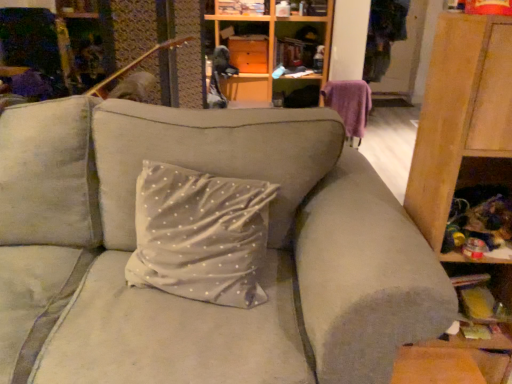
What is the approximate width of light gray fabric couch at center?

It is 37.93 inches.

What do you see at coordinates (300, 50) in the screenshot? This screenshot has height=384, width=512. I see `matte wood cabinet at upper center` at bounding box center [300, 50].

What is the approximate height of wooden cabinet at right?

The height of wooden cabinet at right is 3.87 feet.

Image resolution: width=512 pixels, height=384 pixels. I want to click on light gray fabric couch at center, so click(195, 300).

What's the angular difference between light gray fabric couch at center and wooden cabinet at right's facing directions?

3 degrees separate the facing orientations of light gray fabric couch at center and wooden cabinet at right.

This screenshot has height=384, width=512. In order to click on dresser that is behind the light gray fabric couch at center in this screenshot , I will do `click(458, 113)`.

Are light gray fabric couch at center and wooden cabinet at right making contact?

No, light gray fabric couch at center is not beside wooden cabinet at right.

Is light gray fabric couch at center turned away from wooden cabinet at right?

No, light gray fabric couch at center is not facing away from wooden cabinet at right.

From a real-world perspective, who is located higher, wooden cabinet at right or light gray fabric couch at center?

wooden cabinet at right, from a real-world perspective.

Consider the image. Is wooden cabinet at right wider or thinner than light gray fabric couch at center?

Considering their sizes, wooden cabinet at right looks slimmer than light gray fabric couch at center.

From the picture: Considering the relative sizes of wooden cabinet at right and light gray fabric couch at center in the image provided, is wooden cabinet at right shorter than light gray fabric couch at center?

No.

Is wooden cabinet at right to the right of light gray fabric couch at center from the viewer's perspective?

Indeed, wooden cabinet at right is positioned on the right side of light gray fabric couch at center.

Does wooden cabinet at right turn towards matte wood cabinet at upper center?

No.

Considering the sizes of objects wooden cabinet at right and matte wood cabinet at upper center in the image provided, who is shorter, wooden cabinet at right or matte wood cabinet at upper center?

matte wood cabinet at upper center is shorter.

Is wooden cabinet at right not close to matte wood cabinet at upper center?

wooden cabinet at right is far away from matte wood cabinet at upper center.

Considering the relative positions of wooden cabinet at right and matte wood cabinet at upper center in the image provided, is wooden cabinet at right to the left of matte wood cabinet at upper center from the viewer's perspective?

No.

Considering the sizes of light gray fabric couch at center and purple fabric swivel chair at upper right in the image, is light gray fabric couch at center wider or thinner than purple fabric swivel chair at upper right?

light gray fabric couch at center is wider than purple fabric swivel chair at upper right.

Is light gray fabric couch at center facing towards purple fabric swivel chair at upper right?

No, light gray fabric couch at center is not turned towards purple fabric swivel chair at upper right.

Which is closer, (45, 273) or (344, 98)?

Clearly, point (45, 273) is closer to the camera than point (344, 98).

Is the surface of light gray fabric couch at center in direct contact with purple fabric swivel chair at upper right?

No.

Who is taller, purple fabric swivel chair at upper right or light gray fabric couch at center?

light gray fabric couch at center.

Which of these two, purple fabric swivel chair at upper right or light gray fabric couch at center, is wider?

With larger width is light gray fabric couch at center.

From the image's perspective, which is below, purple fabric swivel chair at upper right or light gray fabric couch at center?

light gray fabric couch at center is shown below in the image.

Can you confirm if purple fabric swivel chair at upper right is bigger than light gray fabric couch at center?

No.

Considering the positions of objects matte wood cabinet at upper center and light gray fabric couch at center in the image provided, who is more to the left, matte wood cabinet at upper center or light gray fabric couch at center?

Positioned to the left is light gray fabric couch at center.

Considering the positions of point (298, 34) and point (106, 360), is point (298, 34) closer or farther from the camera than point (106, 360)?

Point (298, 34) is positioned farther from the camera compared to point (106, 360).

From a real-world perspective, is matte wood cabinet at upper center located beneath light gray fabric couch at center?

No, from a real-world perspective, matte wood cabinet at upper center is not below light gray fabric couch at center.

Is matte wood cabinet at upper center bigger than light gray fabric couch at center?

Incorrect, matte wood cabinet at upper center is not larger than light gray fabric couch at center.

From the image's perspective, relative to purple fabric swivel chair at upper right, is matte wood cabinet at upper center above or below?

matte wood cabinet at upper center is above purple fabric swivel chair at upper right.

Does matte wood cabinet at upper center have a greater height compared to purple fabric swivel chair at upper right?

No, matte wood cabinet at upper center is not taller than purple fabric swivel chair at upper right.

Considering the positions of objects matte wood cabinet at upper center and purple fabric swivel chair at upper right in the image provided, who is in front, matte wood cabinet at upper center or purple fabric swivel chair at upper right?

purple fabric swivel chair at upper right.

The image size is (512, 384). In the image, there is a light gray fabric couch at center. What are the coordinates of `dresser above it (from the image's perspective)` in the screenshot? It's located at (458, 113).

What are the coordinates of `dresser that appears on the right of light gray fabric couch at center` in the screenshot? It's located at (458, 113).

Consider the image. From the image, which object appears to be nearer to purple fabric swivel chair at upper right, matte wood cabinet at upper center or wooden cabinet at right?

matte wood cabinet at upper center is positioned closer to the anchor purple fabric swivel chair at upper right.

Looking at this image, which object lies further to the anchor point light gray fabric couch at center, wooden cabinet at right or purple fabric swivel chair at upper right?

purple fabric swivel chair at upper right.

Which object lies further to the anchor point wooden cabinet at right, purple fabric swivel chair at upper right or light gray fabric couch at center?

Based on the image, purple fabric swivel chair at upper right appears to be further to wooden cabinet at right.

Based on their spatial positions, is light gray fabric couch at center or purple fabric swivel chair at upper right further from wooden cabinet at right?

Among the two, purple fabric swivel chair at upper right is located further to wooden cabinet at right.

Considering their positions, is purple fabric swivel chair at upper right positioned further to light gray fabric couch at center than wooden cabinet at right?

purple fabric swivel chair at upper right lies further to light gray fabric couch at center than the other object.

Looking at the image, which one is located further to light gray fabric couch at center, matte wood cabinet at upper center or wooden cabinet at right?

The object further to light gray fabric couch at center is matte wood cabinet at upper center.

Which object lies nearer to the anchor point wooden cabinet at right, light gray fabric couch at center or matte wood cabinet at upper center?

The object closer to wooden cabinet at right is light gray fabric couch at center.

From the image, which object appears to be nearer to purple fabric swivel chair at upper right, wooden cabinet at right or matte wood cabinet at upper center?

matte wood cabinet at upper center lies closer to purple fabric swivel chair at upper right than the other object.

The image size is (512, 384). I want to click on swivel chair between light gray fabric couch at center and matte wood cabinet at upper center along the z-axis, so click(349, 105).

At what (x,y) coordinates should I click in order to perform the action: click on dresser between light gray fabric couch at center and purple fabric swivel chair at upper right from front to back. Please return your answer as a coordinate pair (x, y). Looking at the image, I should click on (458, 113).

The height and width of the screenshot is (384, 512). Find the location of `dresser between light gray fabric couch at center and matte wood cabinet at upper center from front to back`. dresser between light gray fabric couch at center and matte wood cabinet at upper center from front to back is located at coordinates (458, 113).

Locate an element on the screen. This screenshot has width=512, height=384. swivel chair between wooden cabinet at right and matte wood cabinet at upper center along the z-axis is located at coordinates (349, 105).